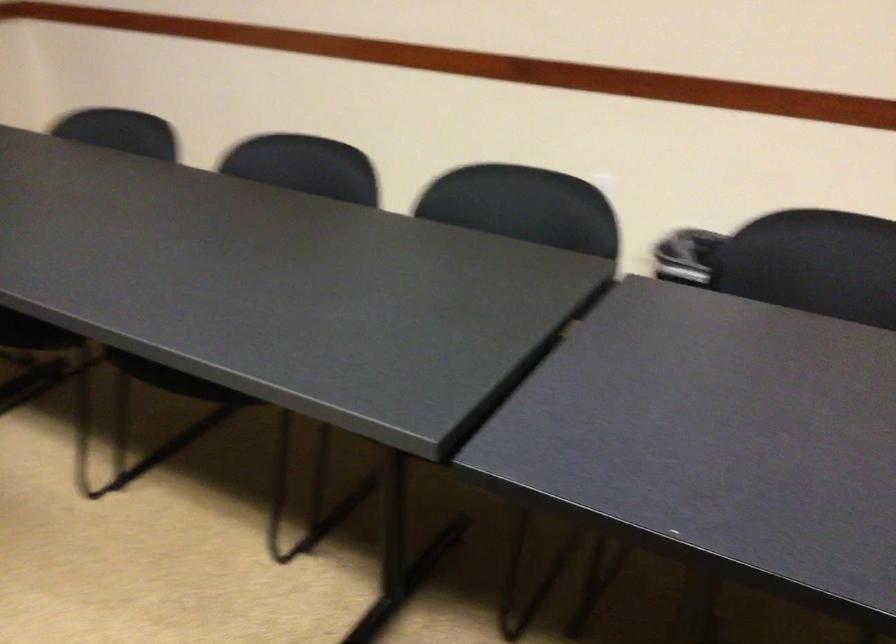
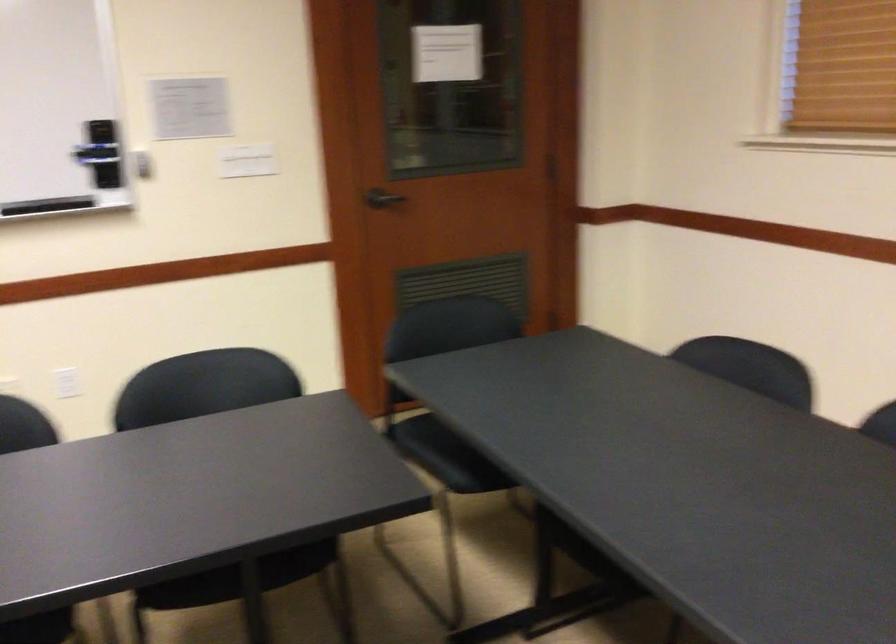
Question: The camera is either moving clockwise (left) or counter-clockwise (right) around the object. The first image is from the beginning of the video and the second image is from the end. Is the camera moving left or right when shooting the video?

Choices:
 (A) Left
 (B) Right

Answer: (B)